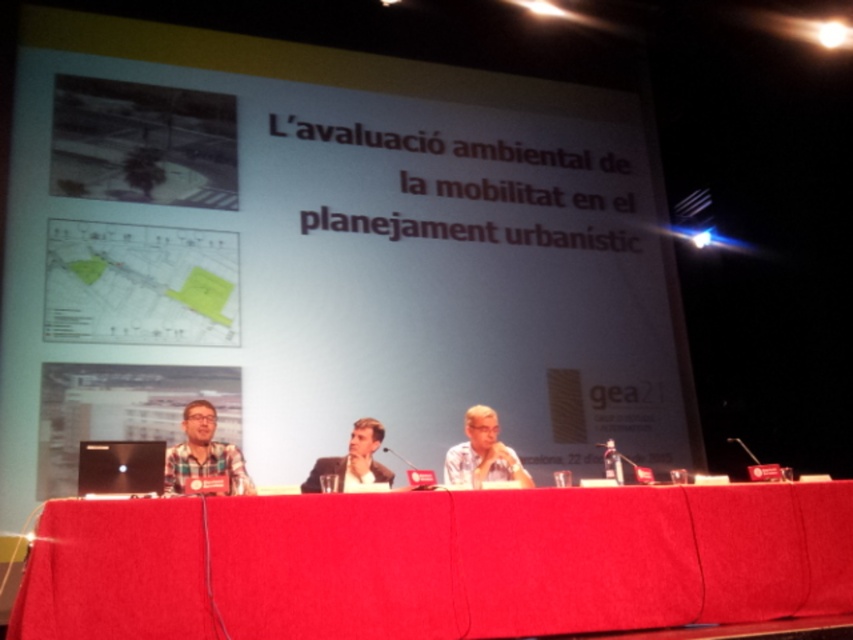
You are a server at a conference, and you need to place a new drink for the panelist in the center of the table. However, there are already two items there. Which item is taller, the matte black glasses at center or the black plastic microphone at center?

The matte black glasses at center is taller than the black plastic microphone at center, so you should place the drink where it won

You are a photographer positioned at the back of the auditorium. You want to capture a closeup shot of the smooth skin face at center and the black plastic microphone at center. Can you fit both in the frame without moving your camera position?

The smooth skin face at center might be wider than the black plastic microphone at center, so it depends on the camera lens and framing. If the face is wider, you may need to adjust the zoom to ensure both fit.

You are an event organizer arranging a panel discussion. You have a red fabric table at center and a plaid fabric shirt at center. Which object is closer to the audience? Please explain your reasoning based on their positions.

The red fabric table at center is closer to the audience because it is positioned in front of the plaid fabric shirt at center, meaning the table is between the audience and the shirt.